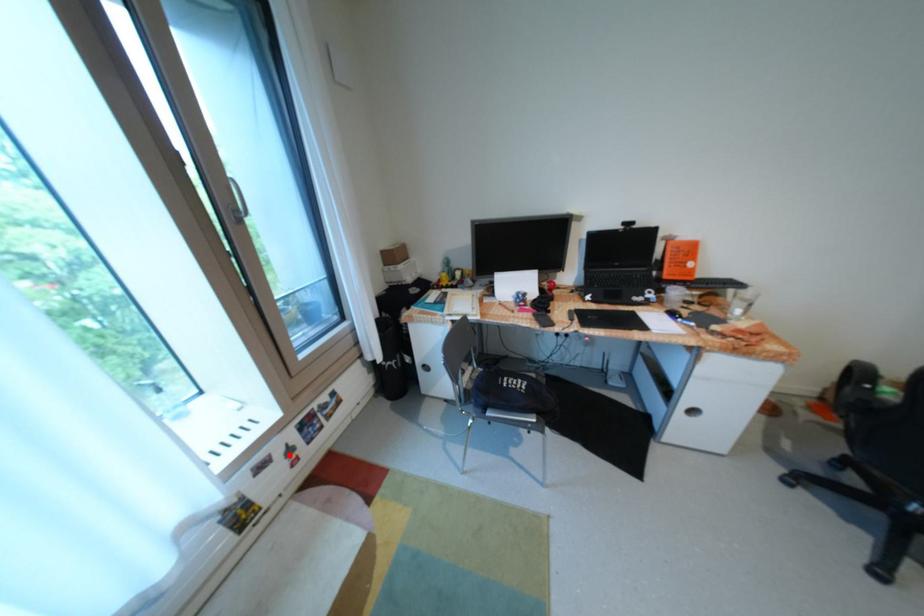
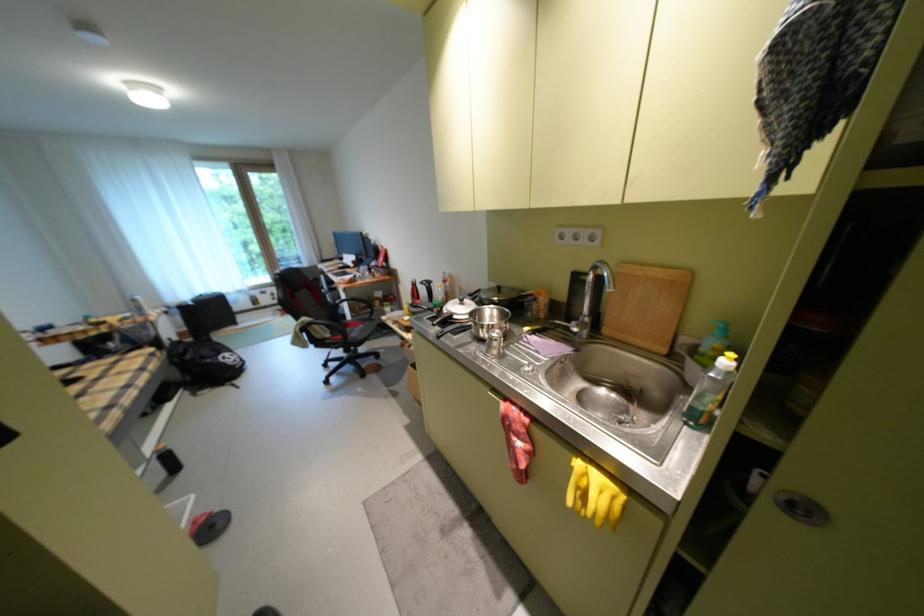
Question: A red point is marked in image1. In image2, is the corresponding 3D point closer to the camera or farther? Reply with the corresponding letter.

Choices:
 (A) The corresponding 3D point is closer.
 (B) The corresponding 3D point is farther.

Answer: (B)